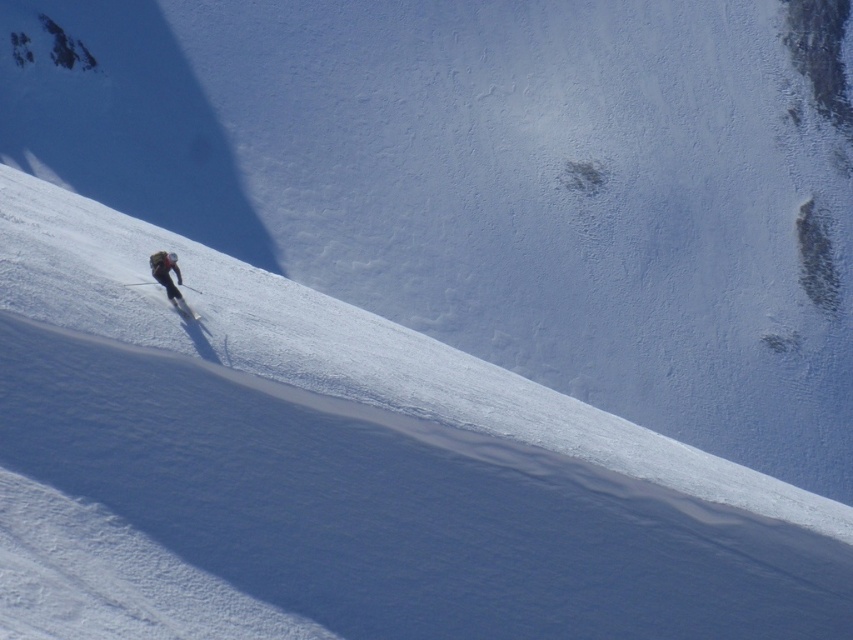
Who is positioned more to the right, white powder snow at center or matte black snowboarder at lower left?

white powder snow at center

Is white powder snow at center further to camera compared to matte black snowboarder at lower left?

No, white powder snow at center is in front of matte black snowboarder at lower left.

Is point (341, 605) closer to viewer compared to point (163, 257)?

Yes, it is in front of point (163, 257).

This screenshot has width=853, height=640. In order to click on white powder snow at center in this screenshot , I will do pos(344,472).

Who is positioned more to the left, matte black snowboarder at lower left or matte black ski at lower left?

matte black ski at lower left

Between matte black snowboarder at lower left and matte black ski at lower left, which one is positioned higher?

matte black ski at lower left is above.

Is point (178, 307) positioned before point (172, 305)?

Yes, it is in front of point (172, 305).

This screenshot has height=640, width=853. Identify the location of matte black snowboarder at lower left. (169, 278).

Is white powder snow at center wider than matte black ski at lower left?

Yes, white powder snow at center is wider than matte black ski at lower left.

Who is positioned more to the left, white powder snow at center or matte black ski at lower left?

matte black ski at lower left

In order to click on white powder snow at center in this screenshot , I will do `click(344, 472)`.